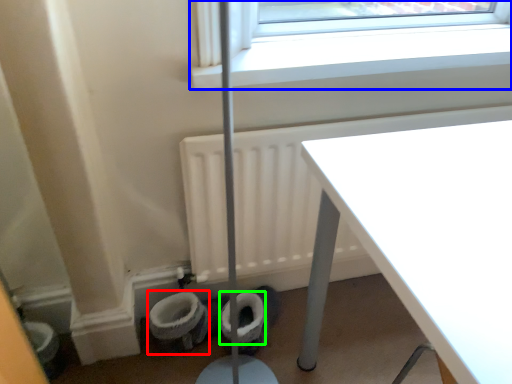
Question: Which object is positioned farthest from toilet bowl (highlighted by a red box)? Select from window (highlighted by a blue box) and toilet paper (highlighted by a green box).

Choices:
 (A) window
 (B) toilet paper

Answer: (A)